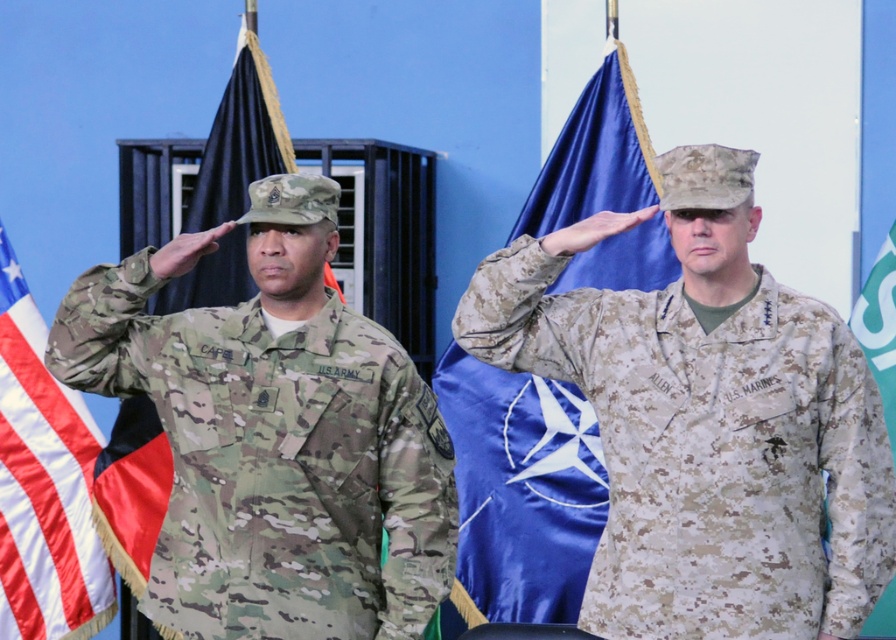
Question: Is multicam uniform at left positioned before black fabric flag at left?

Choices:
 (A) yes
 (B) no

Answer: (A)

Question: Which point is farther to the camera?

Choices:
 (A) (471, 467)
 (B) (487, 320)

Answer: (A)

Question: Can you confirm if american flag at left is positioned to the left of camouflage fabric flag at right?

Choices:
 (A) yes
 (B) no

Answer: (A)

Question: Which of these objects is positioned farthest from the black fabric flag at left?

Choices:
 (A) blue satin flag at center
 (B) american flag at left
 (C) camouflage fabric flag at right

Answer: (C)

Question: Estimate the real-world distances between objects in this image. Which object is closer to the american flag at left?

Choices:
 (A) multicam uniform at left
 (B) blue satin flag at center

Answer: (A)

Question: Is camouflage fabric uniform at right further to camera compared to multicam uniform at left?

Choices:
 (A) no
 (B) yes

Answer: (A)